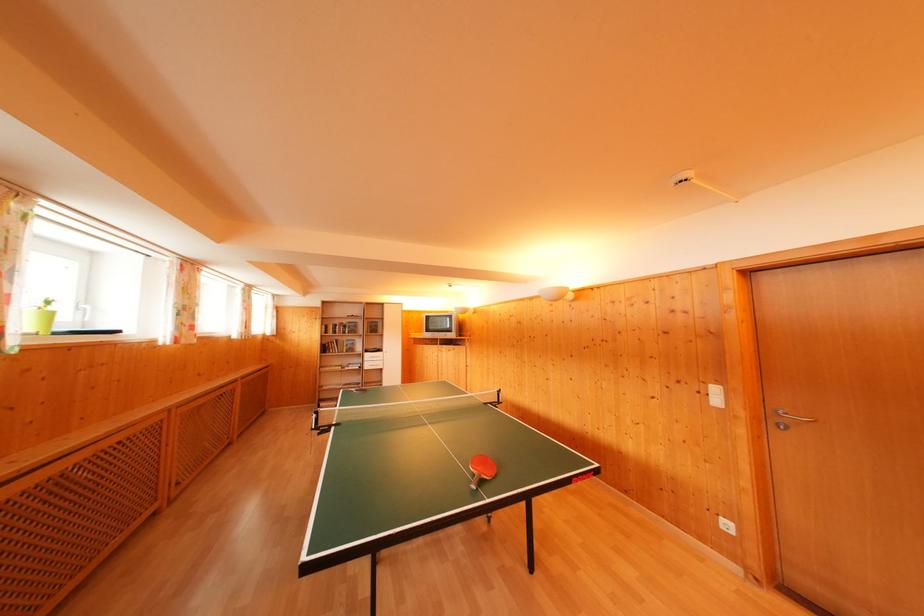
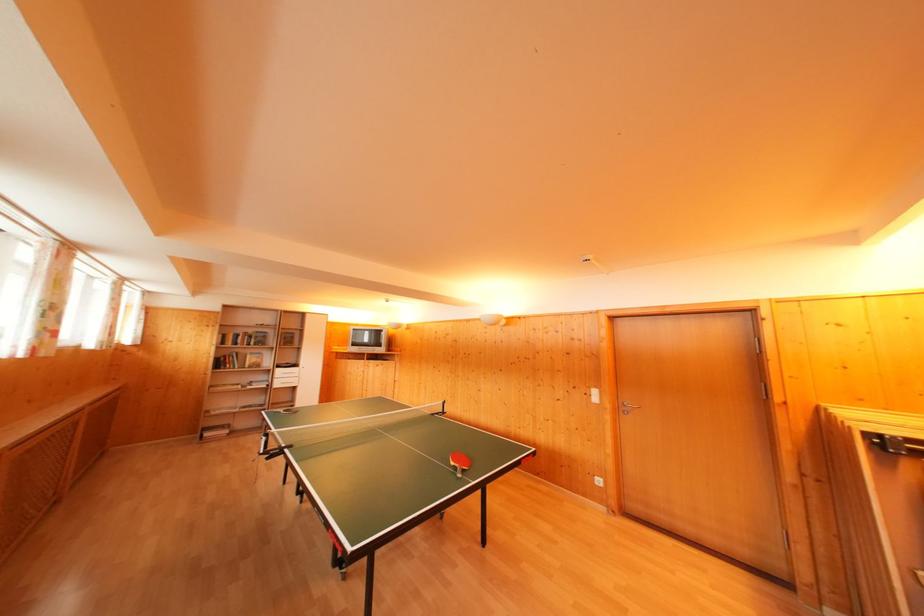
In a continuous first-person perspective shot, in which direction is the camera moving?

The movement direction of the cameraman is left, backward.